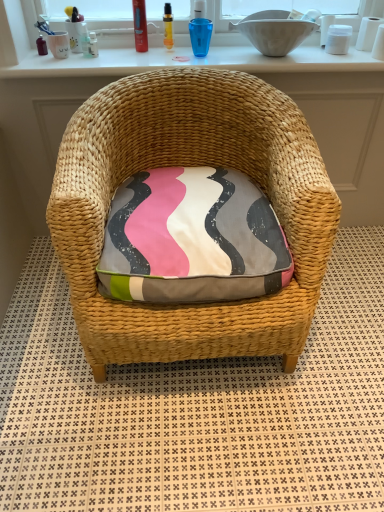
Question: Is the surface of white glossy window sill at upper center in direct contact with natural woven chair at center?

Choices:
 (A) yes
 (B) no

Answer: (B)

Question: Can you confirm if white glossy window sill at upper center is positioned to the left of natural woven chair at center?

Choices:
 (A) yes
 (B) no

Answer: (B)

Question: Is white glossy window sill at upper center further to the viewer compared to natural woven chair at center?

Choices:
 (A) no
 (B) yes

Answer: (B)

Question: Could you tell me if white glossy window sill at upper center is turned towards natural woven chair at center?

Choices:
 (A) no
 (B) yes

Answer: (B)

Question: Considering the relative sizes of white glossy window sill at upper center and natural woven chair at center in the image provided, is white glossy window sill at upper center smaller than natural woven chair at center?

Choices:
 (A) yes
 (B) no

Answer: (A)

Question: From a real-world perspective, is white glossy window sill at upper center physically located above or below woven straw chair at center?

Choices:
 (A) above
 (B) below

Answer: (A)

Question: In the image, is white glossy window sill at upper center positioned in front of or behind woven straw chair at center?

Choices:
 (A) front
 (B) behind

Answer: (B)

Question: From the image's perspective, is white glossy window sill at upper center positioned above or below woven straw chair at center?

Choices:
 (A) below
 (B) above

Answer: (B)

Question: Considering the positions of white glossy window sill at upper center and woven straw chair at center in the image, is white glossy window sill at upper center wider or thinner than woven straw chair at center?

Choices:
 (A) wide
 (B) thin

Answer: (B)

Question: From a real-world perspective, is translucent plastic toothbrush at upper center, the 1th toiletry from the left, physically located above or below textured cotton cushion at center?

Choices:
 (A) below
 (B) above

Answer: (B)

Question: Looking at the image, does translucent plastic toothbrush at upper center, the third toiletry when ordered from right to left, seem bigger or smaller compared to textured cotton cushion at center?

Choices:
 (A) small
 (B) big

Answer: (A)

Question: Based on their positions, is translucent plastic toothbrush at upper center, the third toiletry when ordered from right to left, located to the left or right of textured cotton cushion at center?

Choices:
 (A) left
 (B) right

Answer: (A)

Question: In terms of height, does translucent plastic toothbrush at upper center, the 1th toiletry from the left, look taller or shorter compared to textured cotton cushion at center?

Choices:
 (A) short
 (B) tall

Answer: (A)

Question: Is point (347, 162) closer or farther from the camera than point (281, 16)?

Choices:
 (A) farther
 (B) closer

Answer: (A)

Question: Is natural woven chair at center spatially inside white ceramic bowl at upper center, or outside of it?

Choices:
 (A) inside
 (B) outside

Answer: (B)